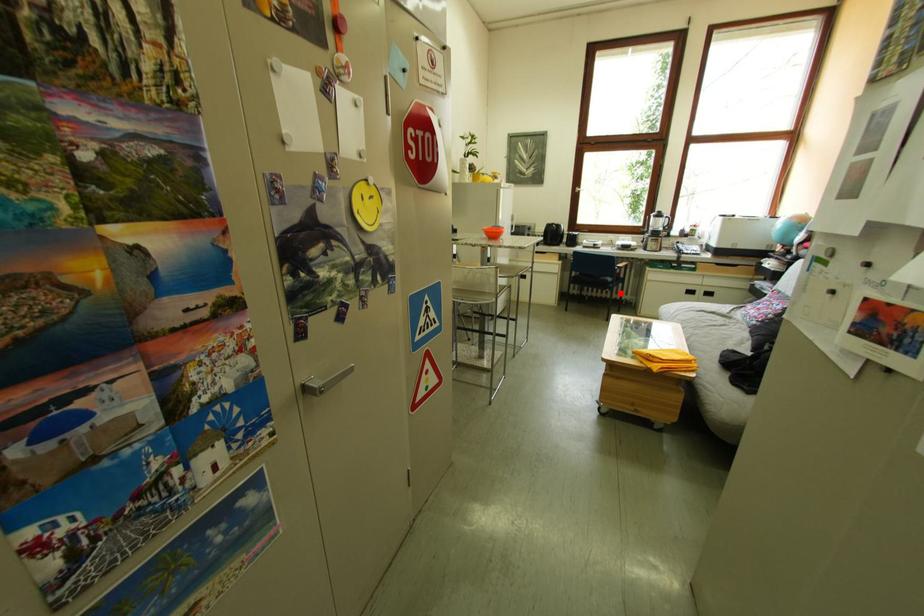
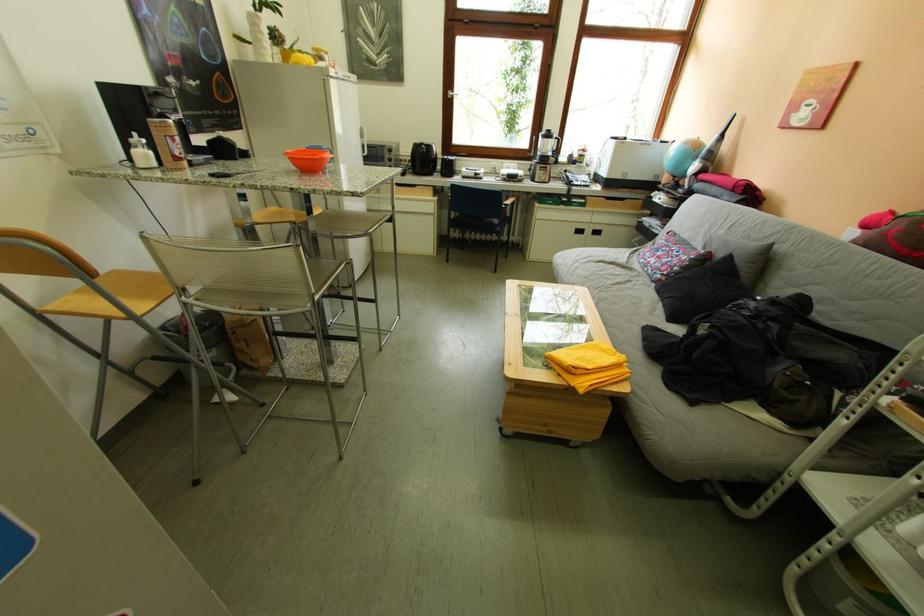
Find the pixel in the second image that matches the highlighted location in the first image.

(507, 238)